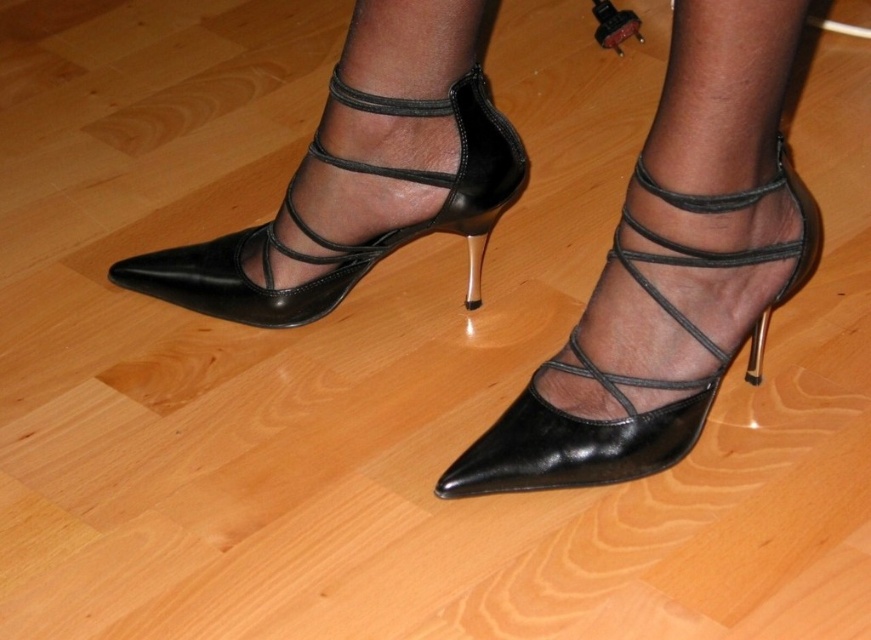
Question: Does black leather sandal at left appear over black leather heel at center?

Choices:
 (A) yes
 (B) no

Answer: (A)

Question: Which point appears farthest from the camera in this image?

Choices:
 (A) (468, 307)
 (B) (685, 428)

Answer: (A)

Question: Which point is closer to the camera taking this photo?

Choices:
 (A) (611, 410)
 (B) (474, 308)
 (C) (582, 368)
 (D) (488, 179)

Answer: (A)

Question: Among these points, which one is farthest from the camera?

Choices:
 (A) (424, 173)
 (B) (495, 444)
 (C) (733, 237)

Answer: (A)

Question: Is black leather high heels at center positioned before black leather sandal at left?

Choices:
 (A) yes
 (B) no

Answer: (A)

Question: Is black leather sandal at center to the left of black leather heel at center from the viewer's perspective?

Choices:
 (A) no
 (B) yes

Answer: (A)